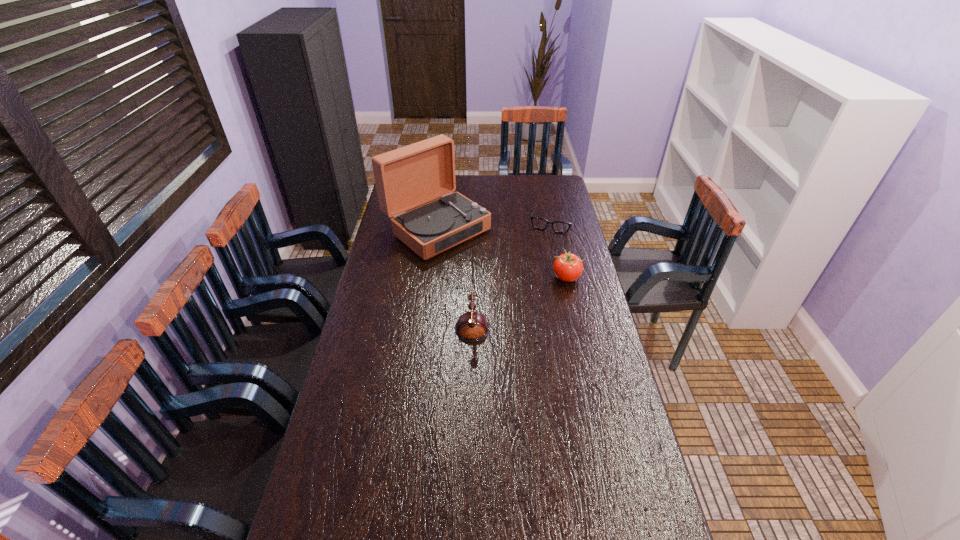
Locate an element on the screen. Image resolution: width=960 pixels, height=540 pixels. telephone is located at coordinates (472, 326).

The image size is (960, 540). Find the location of `tomato`. tomato is located at coordinates (567, 267).

The image size is (960, 540). Find the location of `the shortest object`. the shortest object is located at coordinates (539, 223).

This screenshot has height=540, width=960. Identify the location of phonograph record. (407, 177).

Find the location of a particular element. This screenshot has width=960, height=540. vacant space situated 0.100m on the rotary dial of the telephone is located at coordinates (417, 314).

Where is `vacant point located 0.310m on the rotary dial of the telephone`? The height and width of the screenshot is (540, 960). vacant point located 0.310m on the rotary dial of the telephone is located at coordinates (361, 314).

This screenshot has height=540, width=960. In order to click on vacant space situated 0.180m on the rotary dial of the telephone in this screenshot , I will do 396,314.

The image size is (960, 540). In order to click on free region located on the front of the tomato in this screenshot , I will do 577,322.

Find the location of a particular element. blank space located 0.230m on the front-facing side of the spectacles is located at coordinates (538, 264).

You are a GUI agent. You are given a task and a screenshot of the screen. Output one action in this format:
    pyautogui.click(x=<x>, y=<y>)
    Task: Click on the vacant space located 0.380m on the front-facing side of the spectacles
    The image size is (960, 540).
    Given the screenshot: What is the action you would take?
    pyautogui.click(x=529, y=286)